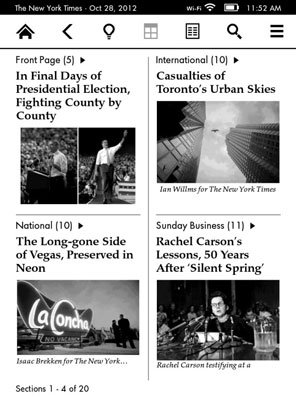
Find the location of `lightbulb`. lightbulb is located at coordinates (108, 29).